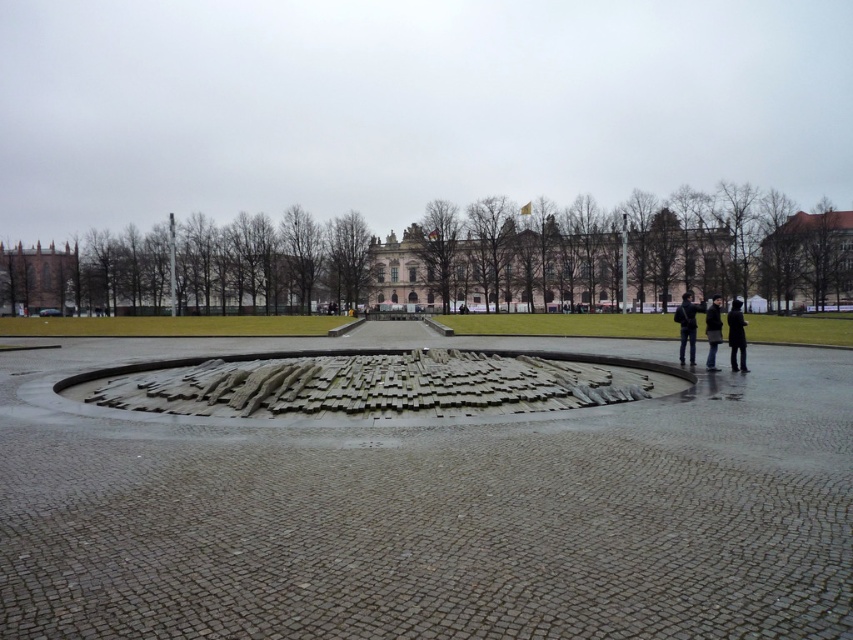
You are a tourist standing in the plaza and want to take a photo of the pink stone palace at center and the dark gray jacket at right. Which object should you frame first in your camera viewfinder to ensure both are in the shot?

You should frame the pink stone palace at center first because it is positioned to the left of the dark gray jacket at right, so starting with the left side ensures both objects are included in the photo.

You are standing at the center of the circular paved area in the public square. Looking towards the brown brick building at left, what direction should you face to see it?

Since the brown brick building at left is located at point (38, 278), you should face towards the left direction to see it from the center of the circular paved area.